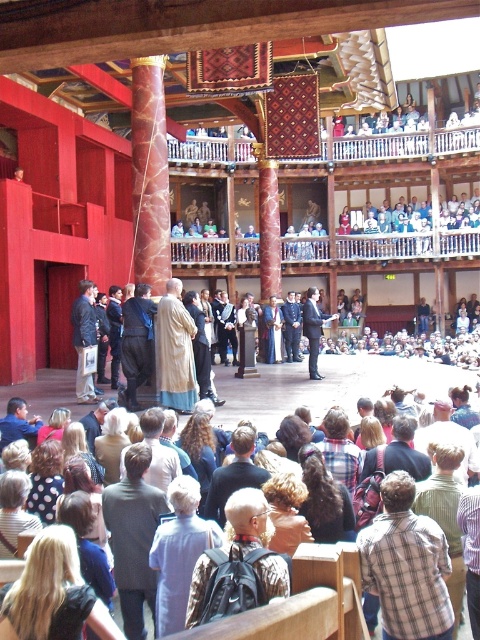
Does plaid shirt at center have a larger size compared to camouflage backpack at lower center?

Correct, plaid shirt at center is larger in size than camouflage backpack at lower center.

In the scene shown: Which is above, plaid shirt at center or camouflage backpack at lower center?

camouflage backpack at lower center

Image resolution: width=480 pixels, height=640 pixels. I want to click on plaid shirt at center, so click(x=407, y=564).

Is dark gray suit at center positioned in front of light blue shirt at center?

No, it is behind light blue shirt at center.

Who is lower down, dark gray suit at center or light blue shirt at center?

light blue shirt at center

Where is `dark gray suit at center`? dark gray suit at center is located at coordinates (133, 536).

How far apart are dark gray suit at center and camouflage backpack at lower center?

dark gray suit at center and camouflage backpack at lower center are 4.38 meters apart.

Can you confirm if dark gray suit at center is shorter than camouflage backpack at lower center?

No, dark gray suit at center is not shorter than camouflage backpack at lower center.

Who is more distant from viewer, (113, 540) or (285, 584)?

The point (113, 540) is behind.

The height and width of the screenshot is (640, 480). Identify the location of dark gray suit at center. 133,536.